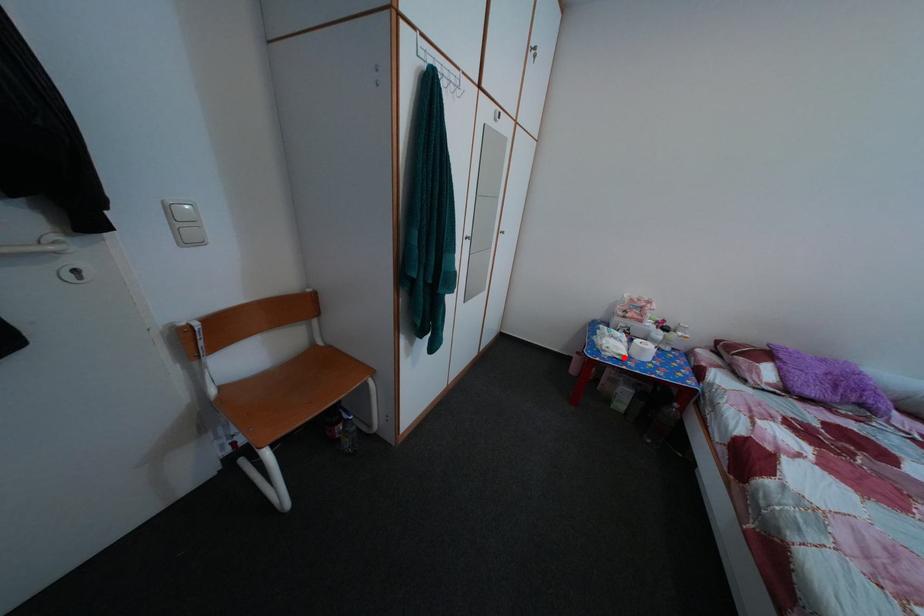
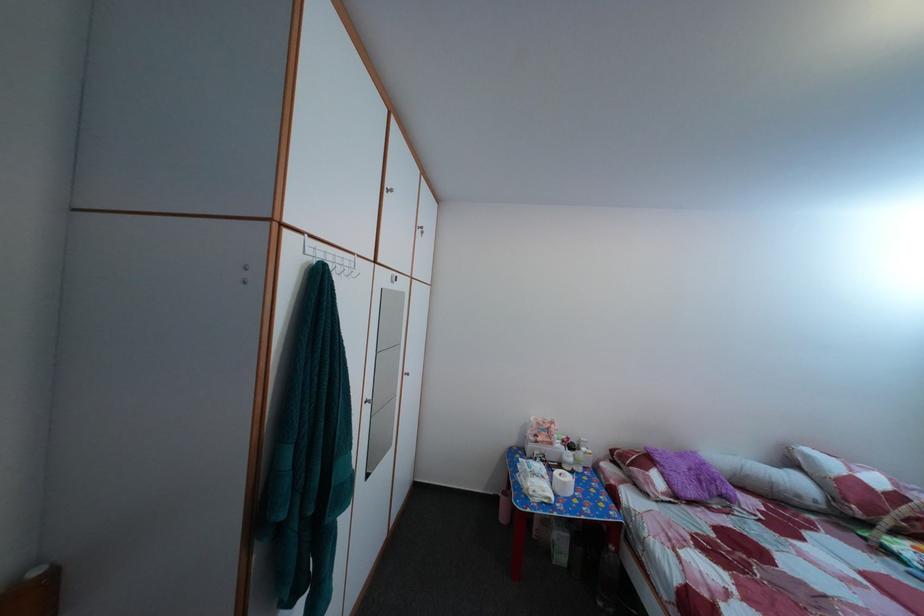
Question: I am providing you with two images of the same scene from different viewpoints. Image1 has a red point marked. In image2, the corresponding 3D location appears at what relative position? Reply with the corresponding letter.

Choices:
 (A) Closer
 (B) Farther

Answer: (B)